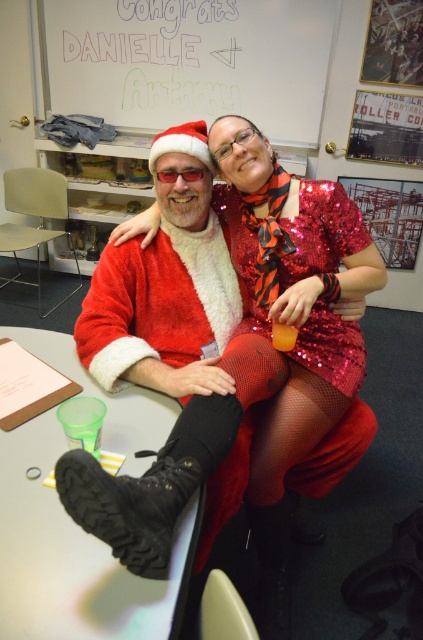
Which is in front, point (291, 120) or point (242, 289)?

Point (242, 289)

Can you confirm if whiteboard at upper center is smaller than shiny sequined dress at center?

No.

Image resolution: width=423 pixels, height=640 pixels. What do you see at coordinates (192, 61) in the screenshot?
I see `whiteboard at upper center` at bounding box center [192, 61].

Find the location of `whiteboard at upper center`. whiteboard at upper center is located at coordinates (192, 61).

Who is positioned more to the left, fuzzy red santa suit at center or whiteboard at upper center?

whiteboard at upper center

Which is more to the right, fuzzy red santa suit at center or whiteboard at upper center?

fuzzy red santa suit at center is more to the right.

Describe the element at coordinates (283, 320) in the screenshot. I see `fuzzy red santa suit at center` at that location.

You are a GUI agent. You are given a task and a screenshot of the screen. Output one action in this format:
    pyautogui.click(x=<x>, y=<y>)
    Task: Click on the fuzzy red santa suit at center
    This screenshot has width=423, height=640.
    Given the screenshot: What is the action you would take?
    pyautogui.click(x=283, y=320)

The image size is (423, 640). What do you see at coordinates (283, 320) in the screenshot?
I see `fuzzy red santa suit at center` at bounding box center [283, 320].

Does fuzzy red santa suit at center have a greater width compared to shiny sequined dress at center?

Yes.

Is point (269, 513) behind point (346, 253)?

Yes, it is behind point (346, 253).

The height and width of the screenshot is (640, 423). In order to click on fuzzy red santa suit at center in this screenshot , I will do `click(283, 320)`.